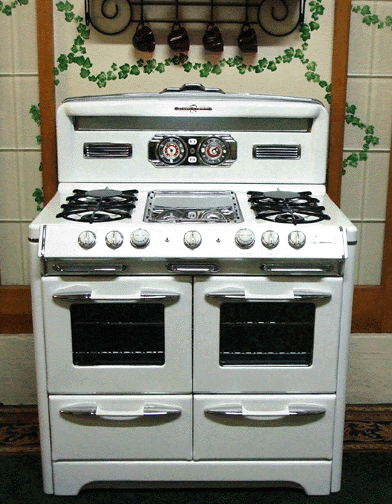
Identify the location of back left burner. This screenshot has height=504, width=392. (86, 196).